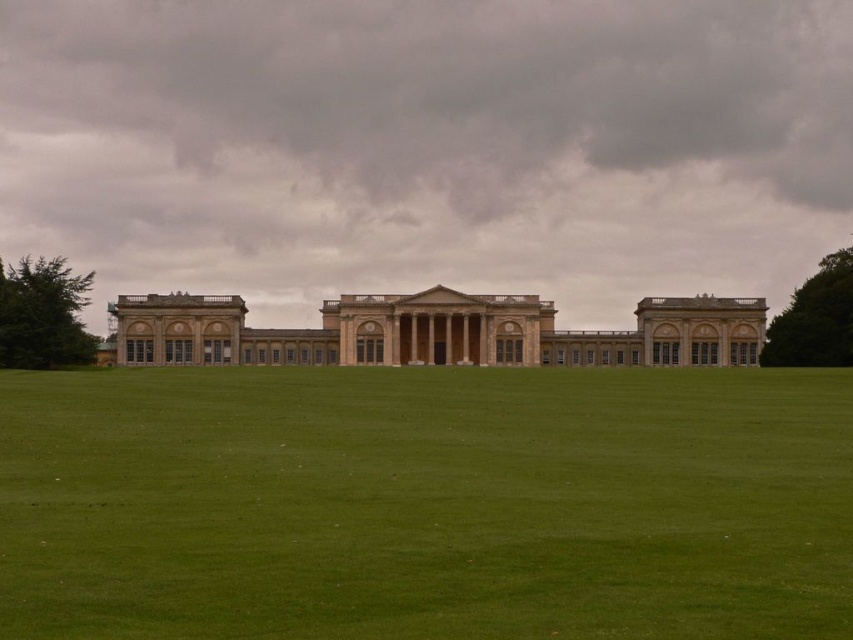
Does green grass at center appear under green leafy tree at left?

Indeed, green grass at center is positioned under green leafy tree at left.

Between green grass at center and green leafy tree at left, which one has more height?

green grass at center

Is point (815, 561) behind point (55, 349)?

No, it is in front of (55, 349).

In order to click on green grass at center in this screenshot , I will do `click(425, 504)`.

Is green grass at center behind beige stone mansion at center?

No, it is not.

Does green grass at center have a lesser width compared to beige stone mansion at center?

In fact, green grass at center might be wider than beige stone mansion at center.

Who is more forward, (808, 627) or (479, 332)?

Point (808, 627) is in front.

The image size is (853, 640). What are the coordinates of `green grass at center` in the screenshot? It's located at (425, 504).

Looking at this image, is beige stone mansion at center shorter than green leafy tree at left?

Correct, beige stone mansion at center is not as tall as green leafy tree at left.

Is beige stone mansion at center below green leafy tree at left?

Yes.

Is point (178, 349) positioned in front of point (16, 316)?

No.

This screenshot has width=853, height=640. In order to click on beige stone mansion at center in this screenshot , I will do `click(436, 332)`.